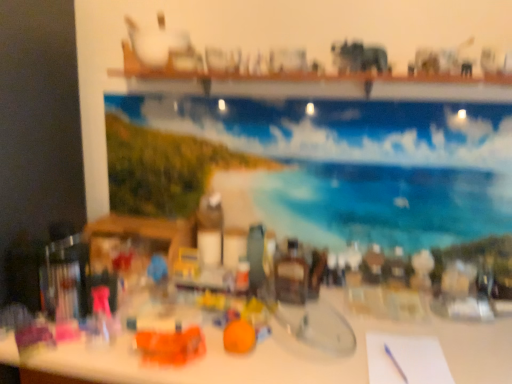
The width and height of the screenshot is (512, 384). In order to click on blank space situated above blue glossy painting at upper center (from a real-world perspective) in this screenshot , I will do [x=293, y=100].